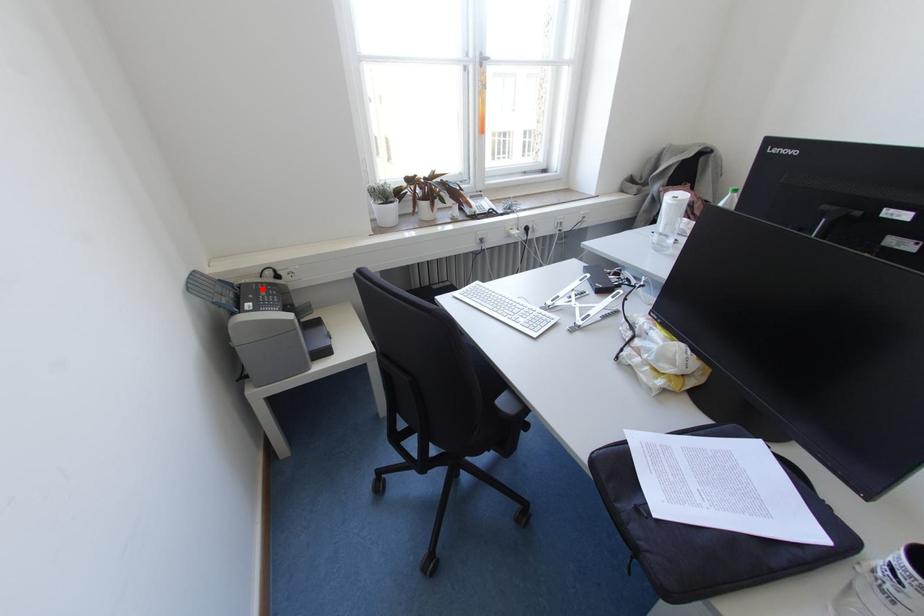
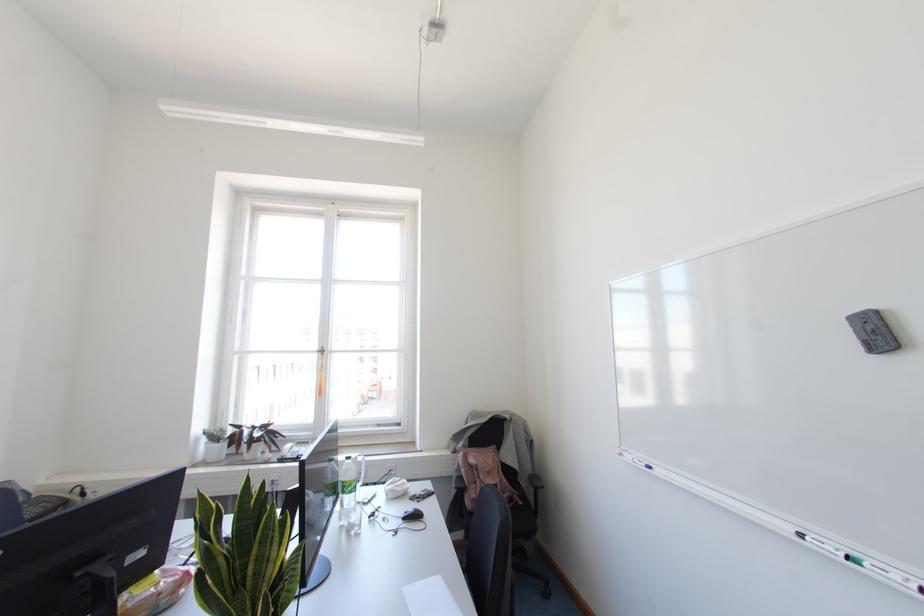
Question: I am providing you with two images of the same scene from different viewpoints. A red point is shown in image1. For the corresponding object point in image2, is it positioned nearer or farther from the camera?

Choices:
 (A) Nearer
 (B) Farther

Answer: (B)